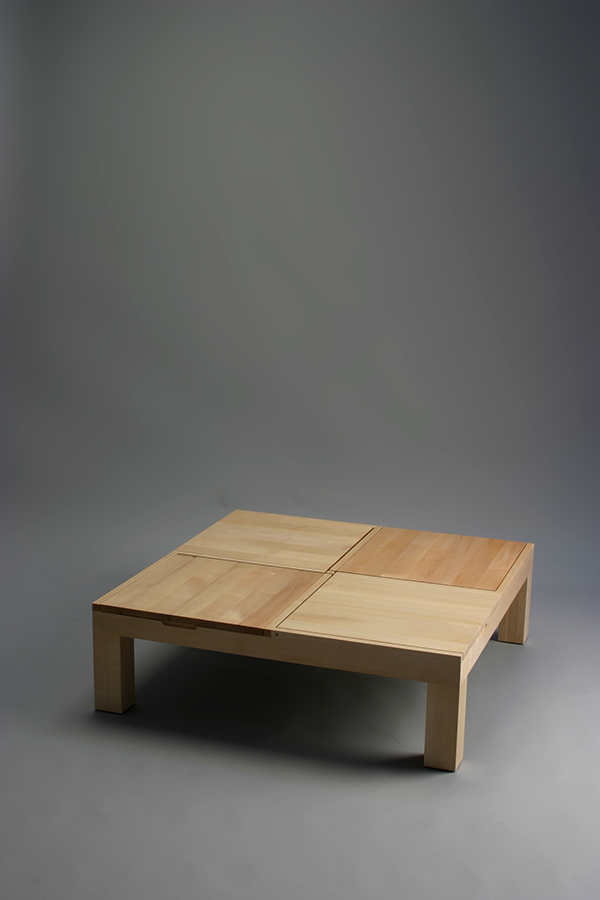
The height and width of the screenshot is (900, 600). Identify the location of left bottom corner of table. (210, 577).